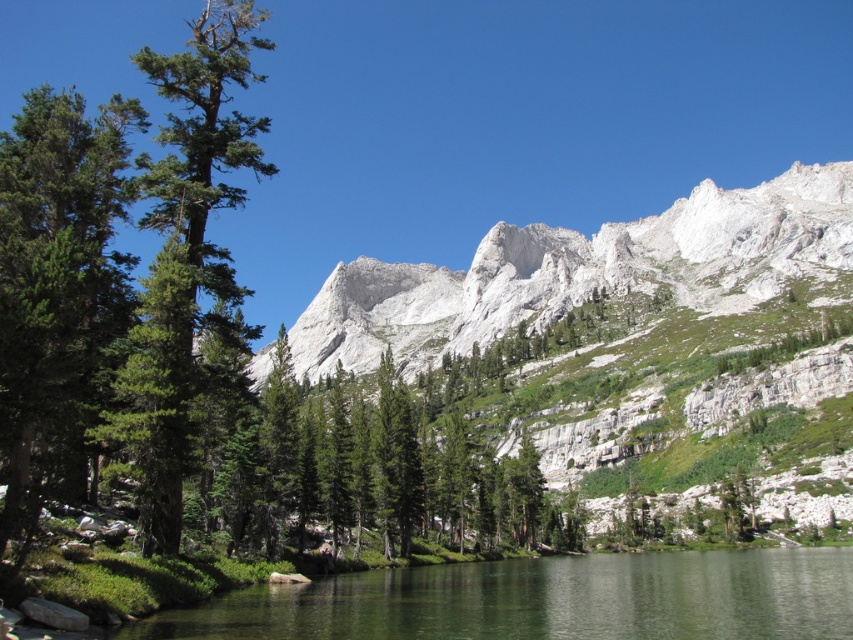
You are standing at the edge of the lake in the image. There is a point marked at coordinates (546, 600). What is located at this point?

The point marked at coordinates (546, 600) indicates clear water at the center of the lake.

Based on the photo, you are a hiker planning to walk from the green matte tree at left to the white rocky mountain at upper center. What is the approximate distance you need to cover?

The distance between the green matte tree at left and the white rocky mountain at upper center is approximately 201.59 meters.

You are standing on the lakeshore and want to take a photo of the green textured pine tree at left and the clear water at center. Which object is closer to the camera? Please explain based on their positions.

The green textured pine tree at left is closer to the camera because the clear water at center is positioned under it, meaning the pine tree is in front of the water in the scene.